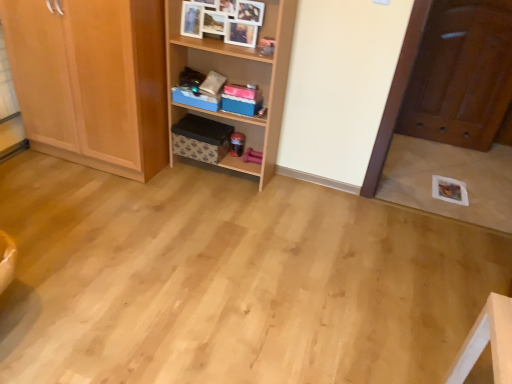
This screenshot has height=384, width=512. I want to click on vacant space situated on the left part of shiny brown door at right, so click(412, 148).